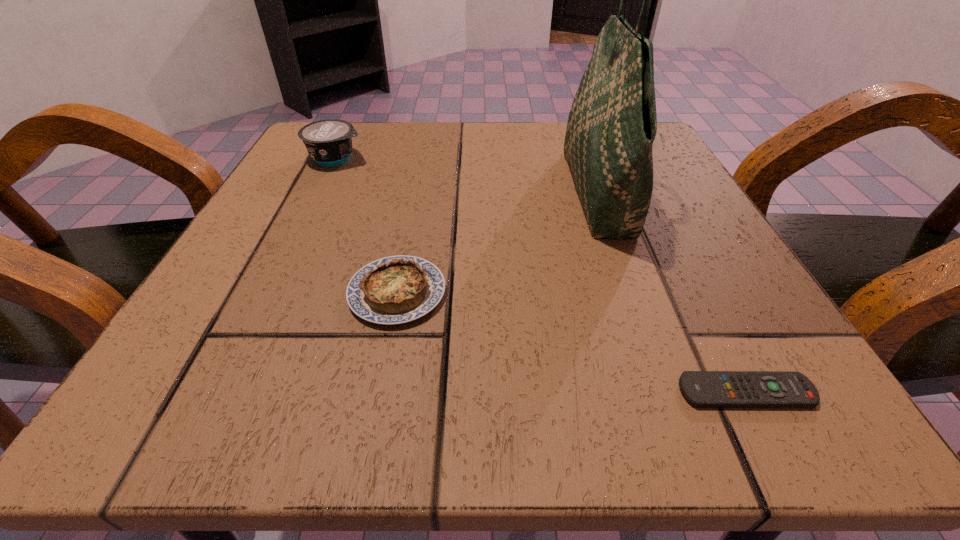
Locate an element on the screen. This screenshot has height=540, width=960. vacant region that satisfies the following two spatial constraints: 1. on the front side of the leftmost object; 2. on the right side of the nearest object is located at coordinates (222, 392).